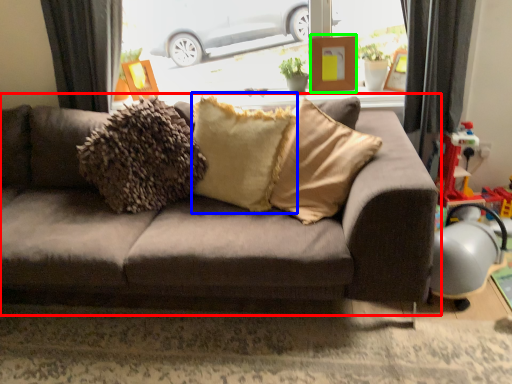
Question: Considering the real-world distances, which object is farthest from studio couch (highlighted by a red box)? pillow (highlighted by a blue box) or picture frame (highlighted by a green box)?

Choices:
 (A) pillow
 (B) picture frame

Answer: (B)